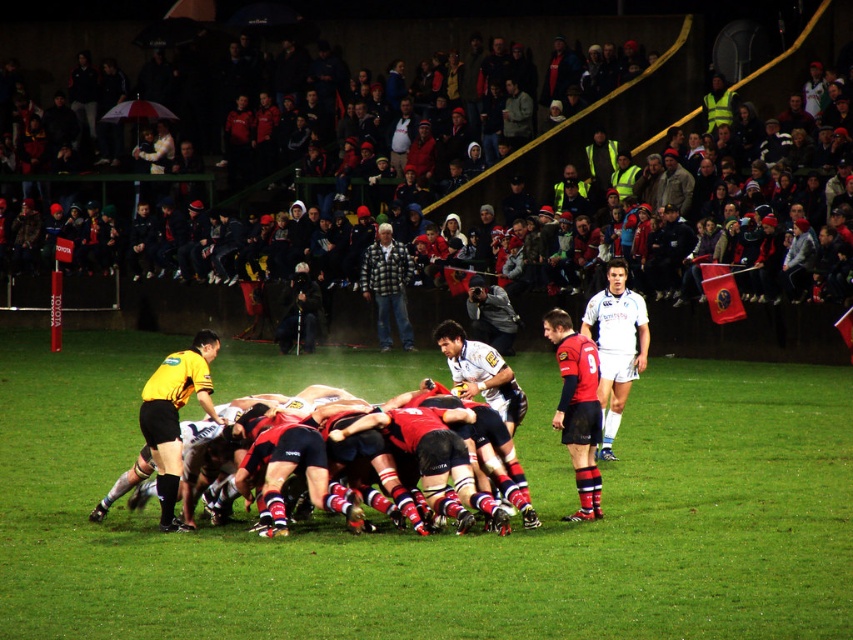
Question: Which of these objects is positioned farthest from the yellow jersey at center?

Choices:
 (A) plaid jacket at center
 (B) white jersey at center
 (C) red matte jersey at center
 (D) dark clothing crowd at upper center

Answer: (D)

Question: Does green grass football field at center appear on the left side of yellow jersey at center?

Choices:
 (A) no
 (B) yes

Answer: (A)

Question: Can you confirm if dark clothing crowd at upper center is positioned below plaid jacket at center?

Choices:
 (A) no
 (B) yes

Answer: (A)

Question: Among these objects, which one is nearest to the camera?

Choices:
 (A) yellow jersey at center
 (B) dark clothing crowd at upper center
 (C) red matte jersey at center
 (D) green grass football field at center

Answer: (D)

Question: Which object is farther from the camera taking this photo?

Choices:
 (A) dark clothing crowd at upper center
 (B) yellow jersey at center
 (C) white jersey at center

Answer: (A)

Question: Is dark clothing crowd at upper center bigger than plaid jacket at center?

Choices:
 (A) yes
 (B) no

Answer: (A)